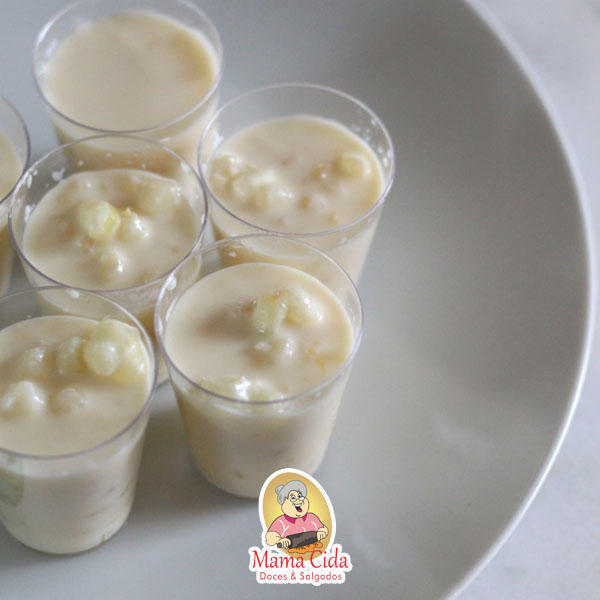
The image size is (600, 600). What are the coordinates of `table` in the screenshot? It's located at (562, 40).